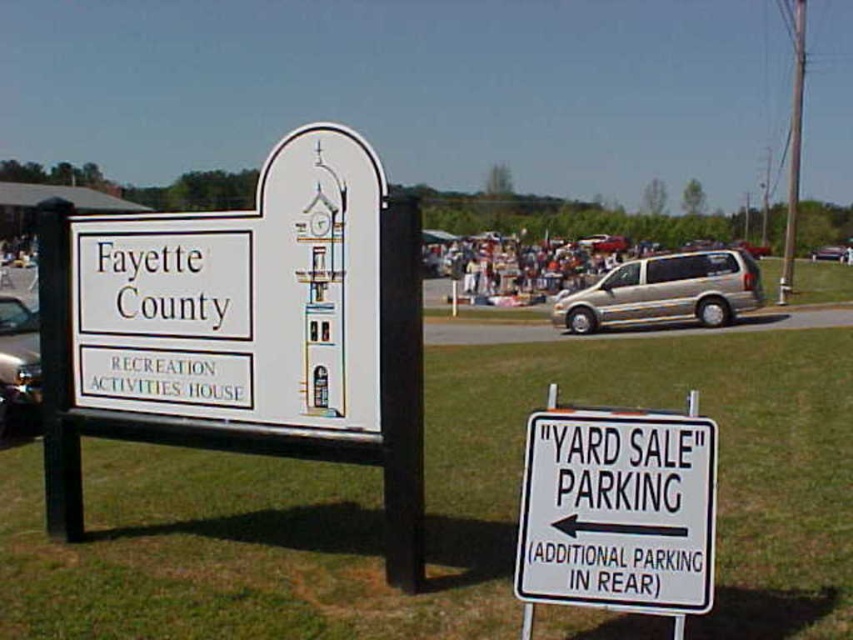
Which is in front, point (726, 288) or point (1, 316)?

Point (1, 316) is more forward.

Is gold metallic minivan at right further to the viewer compared to metallic silver van at center?

Yes, gold metallic minivan at right is further from the viewer.

Which is behind, point (733, 312) or point (22, 304)?

Positioned behind is point (733, 312).

Locate an element on the screen. The width and height of the screenshot is (853, 640). gold metallic minivan at right is located at coordinates (665, 291).

Is white plastic sign at lower center shorter than metallic silver van at center?

Correct, white plastic sign at lower center is not as tall as metallic silver van at center.

Does white plastic sign at lower center have a lesser width compared to metallic silver van at center?

Correct, white plastic sign at lower center's width is less than metallic silver van at center's.

Between point (587, 563) and point (24, 394), which one is positioned behind?

Point (24, 394)

Locate an element on the screen. This screenshot has width=853, height=640. white plastic sign at lower center is located at coordinates (618, 509).

The width and height of the screenshot is (853, 640). In order to click on metallic silver van at center in this screenshot , I will do `click(18, 364)`.

Who is taller, metallic silver van at center or metallic silver minivan at center?

metallic silver van at center

Is point (20, 304) less distant than point (833, 252)?

Yes, it is in front of point (833, 252).

Image resolution: width=853 pixels, height=640 pixels. I want to click on metallic silver van at center, so click(x=18, y=364).